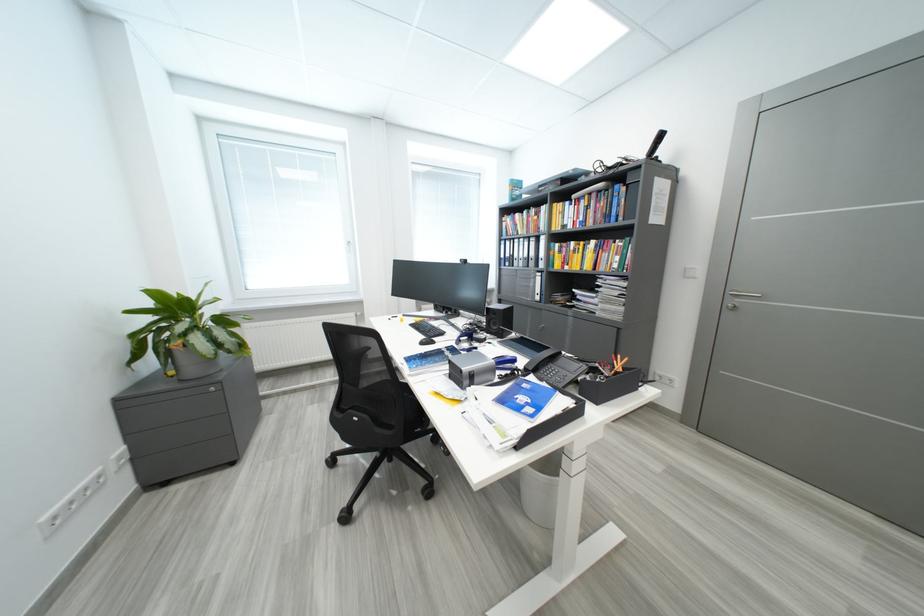
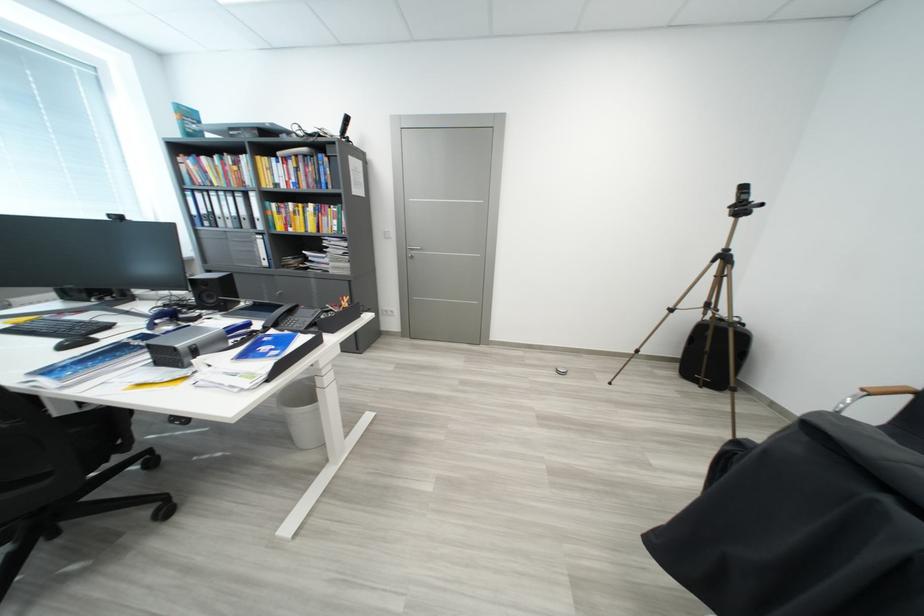
The point at (x=480, y=326) is marked in the first image. Where is the corresponding point in the second image?

(175, 308)